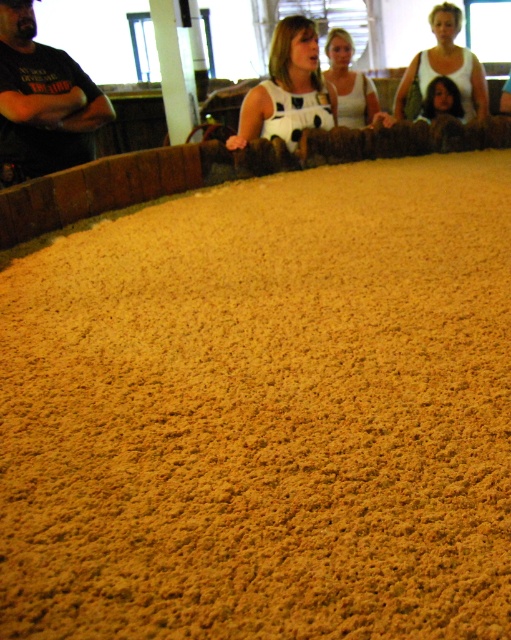
Does white dotted dress at center appear on the left side of smooth brown hair at upper right?

→ Correct, you'll find white dotted dress at center to the left of smooth brown hair at upper right.

Is white dotted dress at center wider than smooth brown hair at upper right?

Correct, the width of white dotted dress at center exceeds that of smooth brown hair at upper right.

Locate an element on the screen. white dotted dress at center is located at coordinates (288, 90).

The width and height of the screenshot is (511, 640). I want to click on white dotted dress at center, so click(288, 90).

Looking at this image, which of these two, white dotted dress at upper center or smooth brown hair at upper right, stands shorter?

With less height is smooth brown hair at upper right.

Can you confirm if white dotted dress at upper center is thinner than smooth brown hair at upper right?

No, white dotted dress at upper center is not thinner than smooth brown hair at upper right.

Between point (399, 116) and point (433, 99), which one is positioned in front?

Positioned in front is point (433, 99).

I want to click on white dotted dress at upper center, so click(446, 67).

Does white matte tank top at upper center have a greater height compared to smooth brown hair at upper right?

Correct, white matte tank top at upper center is much taller as smooth brown hair at upper right.

Locate an element on the screen. Image resolution: width=511 pixels, height=640 pixels. white matte tank top at upper center is located at coordinates (350, 83).